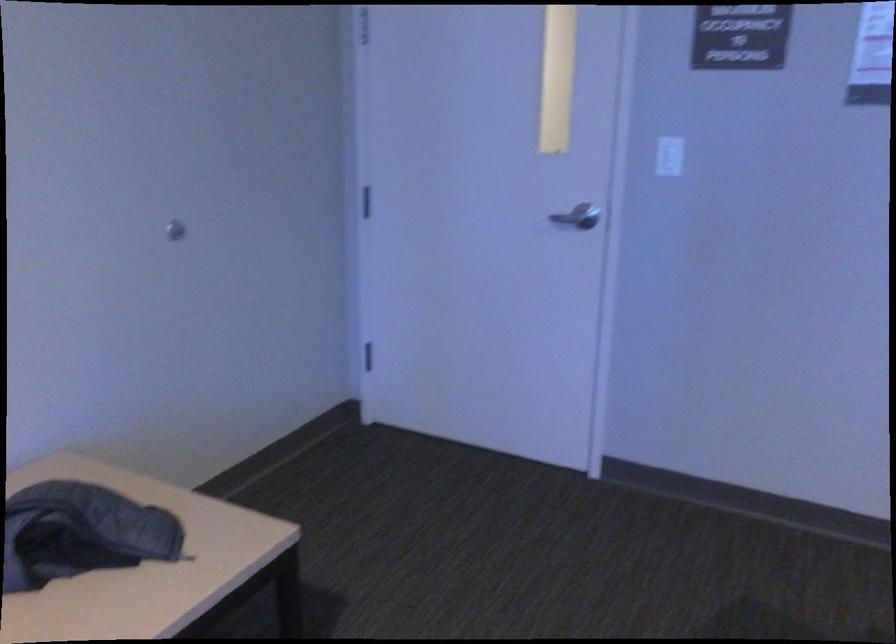
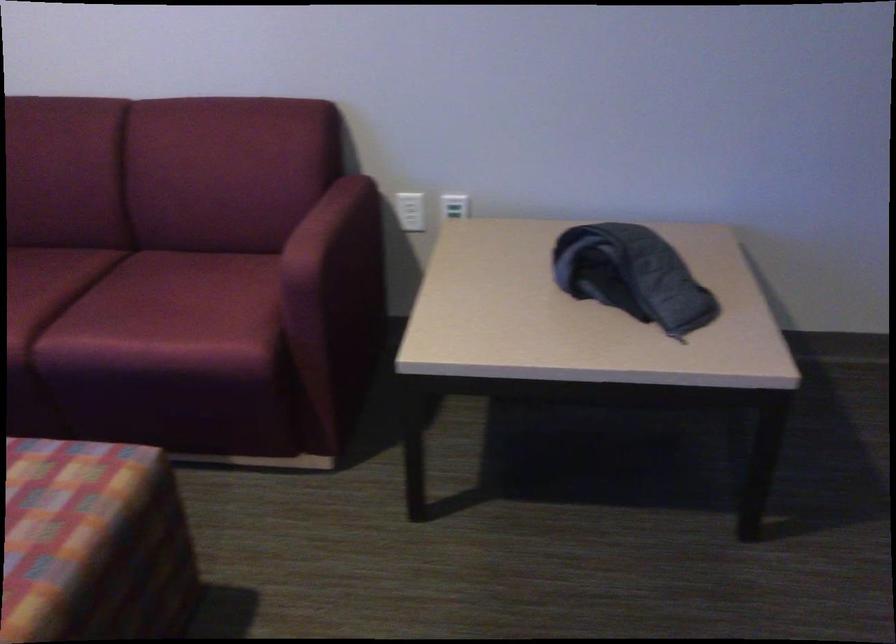
The first image is from the beginning of the video and the second image is from the end. How did the camera likely rotate when shooting the video?

The camera rotated toward left-down.